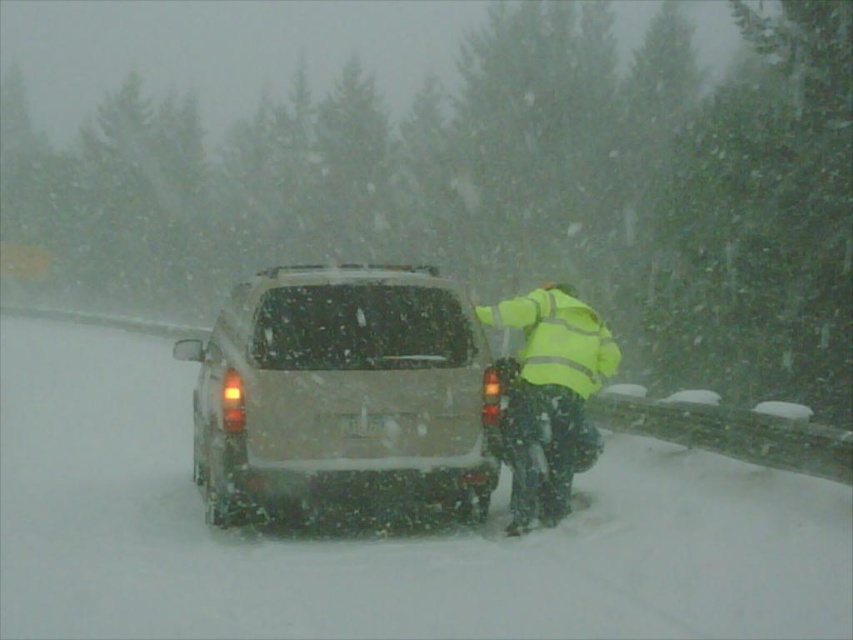
Question: Which of the following is the farthest from the observer?

Choices:
 (A) (375, 429)
 (B) (579, 625)

Answer: (A)

Question: Is white powdery snow at center smaller than white plastic license plate at center?

Choices:
 (A) yes
 (B) no

Answer: (B)

Question: Which point is farther to the camera?

Choices:
 (A) (329, 308)
 (B) (544, 636)

Answer: (A)

Question: Is white powdery snow at center below white plastic license plate at center?

Choices:
 (A) no
 (B) yes

Answer: (B)

Question: Which point is farther from the camera taking this photo?

Choices:
 (A) (553, 364)
 (B) (366, 422)
 (C) (352, 579)

Answer: (A)

Question: Is matte silver minivan at center to the right of white plastic license plate at center from the viewer's perspective?

Choices:
 (A) yes
 (B) no

Answer: (B)